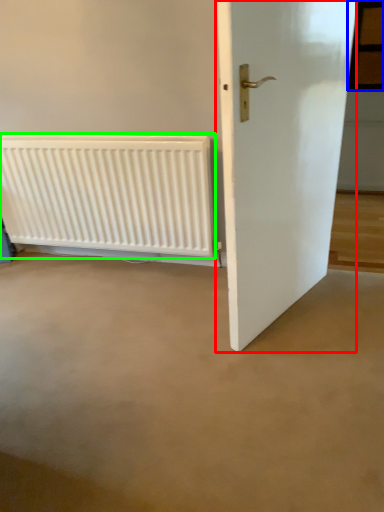
Question: Estimate the real-world distances between objects in this image. Which object is farther from door (highlighted by a red box), window (highlighted by a blue box) or radiator (highlighted by a green box)?

Choices:
 (A) window
 (B) radiator

Answer: (A)